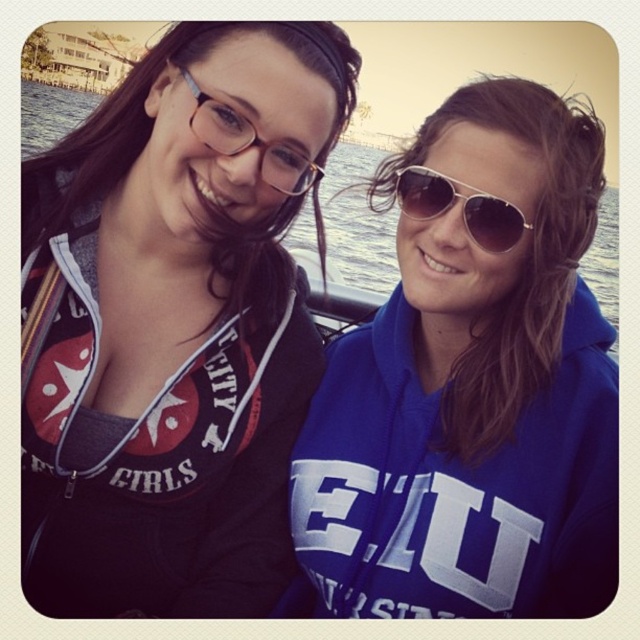
Measure the distance between point (472, 445) and camera.

They are 7.36 meters apart.

Is point (586, 154) closer to viewer compared to point (212, 122)?

No, it is behind (212, 122).

Find the location of `blue matte hoodie at right`. blue matte hoodie at right is located at coordinates (472, 385).

Is matte black hoodie at left thinner than blue matte hoodie at right?

No, matte black hoodie at left is not thinner than blue matte hoodie at right.

Who is more forward, (38, 241) or (458, 109)?

Point (38, 241)

Measure the distance between matte black hoodie at left and camera.

matte black hoodie at left and camera are 6.25 meters apart from each other.

You are a GUI agent. You are given a task and a screenshot of the screen. Output one action in this format:
    pyautogui.click(x=<x>, y=<y>)
    Task: Click on the matte black hoodie at left
    The width and height of the screenshot is (640, 640).
    Given the screenshot: What is the action you would take?
    pyautogui.click(x=176, y=324)

Image resolution: width=640 pixels, height=640 pixels. What do you see at coordinates (176, 324) in the screenshot? I see `matte black hoodie at left` at bounding box center [176, 324].

Which is more to the left, matte black hoodie at left or sunglasses at center?

matte black hoodie at left is more to the left.

Locate an element on the screen. The height and width of the screenshot is (640, 640). matte black hoodie at left is located at coordinates (176, 324).